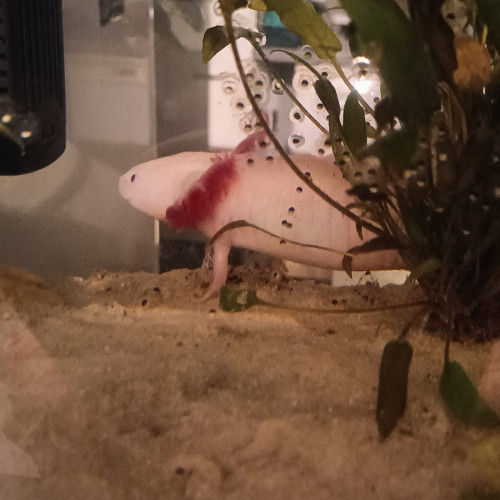
You are a GUI agent. You are given a task and a screenshot of the screen. Output one action in this format:
    pyautogui.click(x=<x>, y=<y>)
    Task: Click on the aquarium
    This screenshot has height=500, width=500.
    Given the screenshot: What is the action you would take?
    pyautogui.click(x=106, y=232)